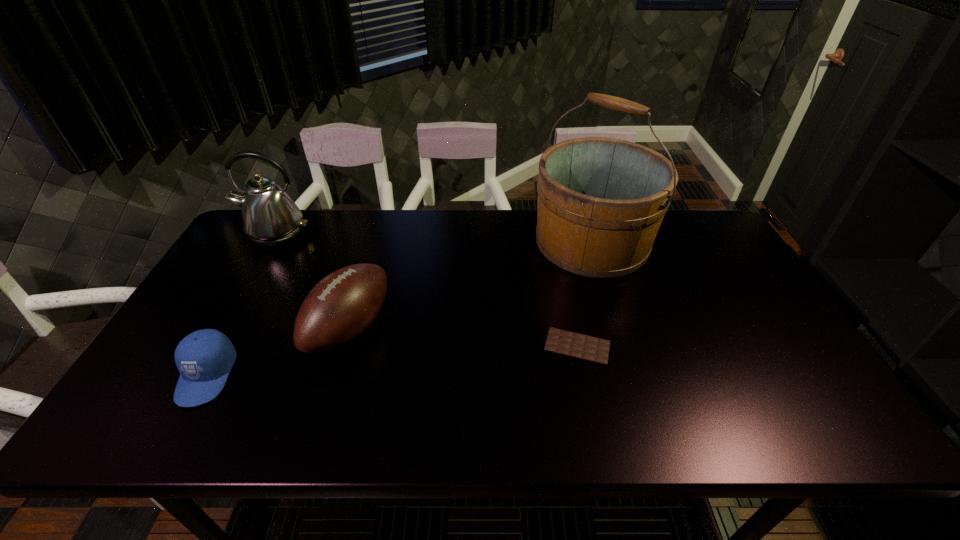
You are a GUI agent. You are given a task and a screenshot of the screen. Output one action in this format:
    pyautogui.click(x=<x>, y=<y>)
    Task: Click on the tallest object
    
    Given the screenshot: What is the action you would take?
    pyautogui.click(x=601, y=201)

Locate an element on the screen. the second tallest object is located at coordinates (270, 218).

Locate an element on the screen. Image resolution: width=960 pixels, height=540 pixels. the third object from right to left is located at coordinates (340, 307).

Image resolution: width=960 pixels, height=540 pixels. Identify the location of the third shortest object. (340, 307).

I want to click on the fourth tallest object, so click(x=204, y=358).

Where is `the shortest object`? Image resolution: width=960 pixels, height=540 pixels. the shortest object is located at coordinates (585, 347).

In order to click on free spot located 0.370m on the front of the tallest object in this screenshot , I will do `click(636, 390)`.

The image size is (960, 540). In order to click on vacant area situated from the spout of the second tallest object in this screenshot , I will do `click(242, 293)`.

What are the coordinates of `free region located on the right of the third shortest object` in the screenshot? It's located at (432, 328).

This screenshot has width=960, height=540. Identify the location of vacant space located 0.060m on the front-facing side of the second shortest object. (175, 434).